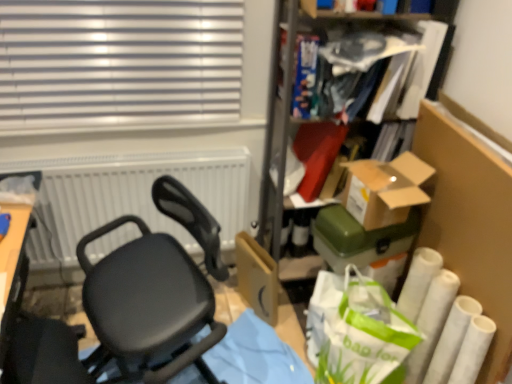
Question: Considering the relative sizes of brown cardboard box at upper right, which ranks as the 2th box in bottom-to-top order, and black matte chair at center in the image provided, is brown cardboard box at upper right, which ranks as the 2th box in bottom-to-top order, wider than black matte chair at center?

Choices:
 (A) yes
 (B) no

Answer: (B)

Question: Does brown cardboard box at upper right, which ranks as the 2th box in bottom-to-top order, appear on the left side of black matte chair at center?

Choices:
 (A) yes
 (B) no

Answer: (B)

Question: Could you tell me if brown cardboard box at upper right, which ranks as the 2th box in bottom-to-top order, is turned towards black matte chair at center?

Choices:
 (A) yes
 (B) no

Answer: (B)

Question: Considering the relative sizes of brown cardboard box at upper right, which ranks as the 2th box in bottom-to-top order, and black matte chair at center in the image provided, is brown cardboard box at upper right, which ranks as the 2th box in bottom-to-top order, taller than black matte chair at center?

Choices:
 (A) no
 (B) yes

Answer: (A)

Question: From the image's perspective, would you say brown cardboard box at upper right, which ranks as the 2th box in bottom-to-top order, is shown under black matte chair at center?

Choices:
 (A) yes
 (B) no

Answer: (B)

Question: From a real-world perspective, is brown cardboard box at upper right, which is counted as the first box, starting from the top, physically below black matte chair at center?

Choices:
 (A) no
 (B) yes

Answer: (A)

Question: Are green paper shopping bag at lower right and cardboard box at center making contact?

Choices:
 (A) no
 (B) yes

Answer: (A)

Question: Is green paper shopping bag at lower right smaller than cardboard box at center?

Choices:
 (A) yes
 (B) no

Answer: (B)

Question: Does green paper shopping bag at lower right have a lesser height compared to cardboard box at center?

Choices:
 (A) no
 (B) yes

Answer: (A)

Question: Does green paper shopping bag at lower right have a lesser width compared to cardboard box at center?

Choices:
 (A) yes
 (B) no

Answer: (B)

Question: Is green paper shopping bag at lower right behind cardboard box at center?

Choices:
 (A) no
 (B) yes

Answer: (A)

Question: Considering the relative sizes of green paper shopping bag at lower right and cardboard box at center in the image provided, is green paper shopping bag at lower right bigger than cardboard box at center?

Choices:
 (A) yes
 (B) no

Answer: (A)

Question: Can you see brown cardboard box at upper right, which is counted as the first box, starting from the top, touching cardboard box at center?

Choices:
 (A) no
 (B) yes

Answer: (A)